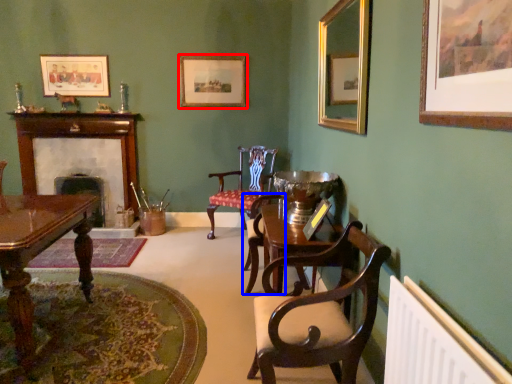
Question: Which object is further to the camera taking this photo, picture frame (highlighted by a red box) or armchair (highlighted by a blue box)?

Choices:
 (A) picture frame
 (B) armchair

Answer: (A)